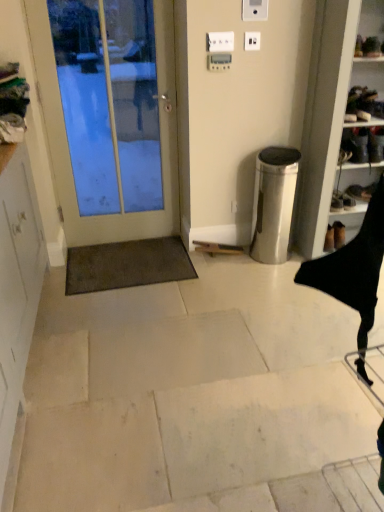
What do you see at coordinates (219, 42) in the screenshot? Image resolution: width=384 pixels, height=512 pixels. I see `white plastic electric outlet at upper center, which appears as the 2th electric outlet when viewed from the right` at bounding box center [219, 42].

The image size is (384, 512). Describe the element at coordinates (362, 145) in the screenshot. I see `black leather shoes at right` at that location.

Where is `brown shaggy mat at lower left`? Image resolution: width=384 pixels, height=512 pixels. brown shaggy mat at lower left is located at coordinates (127, 265).

Where is `white matte cabinet at left`? This screenshot has height=512, width=384. white matte cabinet at left is located at coordinates (17, 287).

Where is `white plastic electric outlet at upper center, arranged as the first electric outlet when viewed from the left`? white plastic electric outlet at upper center, arranged as the first electric outlet when viewed from the left is located at coordinates (219, 42).

Is black leather shoes at right completely or partially outside of white matte cabinet at left?

black leather shoes at right is positioned outside white matte cabinet at left.

Is black leather shoes at right in front of or behind white matte cabinet at left in the image?

black leather shoes at right is positioned farther from the viewer than white matte cabinet at left.

From a real-world perspective, is black leather shoes at right positioned over white matte cabinet at left based on gravity?

Yes.

Considering the relative sizes of black leather shoes at right and white matte cabinet at left in the image provided, is black leather shoes at right shorter than white matte cabinet at left?

Indeed, black leather shoes at right has a lesser height compared to white matte cabinet at left.

Is point (212, 42) less distant than point (172, 67)?

Yes.

Identify the location of the 1st electric outlet behind the white glossy door at left. This screenshot has height=512, width=384. (219, 42).

Is white plastic electric outlet at upper center, which appears as the 2th electric outlet when viewed from the right, looking in the opposite direction of white glossy door at left?

No, white plastic electric outlet at upper center, which appears as the 2th electric outlet when viewed from the right, is not facing away from white glossy door at left.

Measure the distance from white plastic electric outlet at upper center, arranged as the first electric outlet when viewed from the left, to white glossy door at left.

They are 31.67 inches apart.

From a real-world perspective, is white glossy door at left positioned above or below brown shaggy mat at lower left?

Clearly, from a real-world perspective, white glossy door at left is above brown shaggy mat at lower left.

Could you tell me if white glossy door at left is turned towards brown shaggy mat at lower left?

Yes, white glossy door at left faces towards brown shaggy mat at lower left.

Which point is more forward, (178, 190) or (123, 284)?

The point (123, 284) is in front.

Considering the relative positions of white glossy door at left and brown shaggy mat at lower left in the image provided, is white glossy door at left to the left of brown shaggy mat at lower left from the viewer's perspective?

Correct, you'll find white glossy door at left to the left of brown shaggy mat at lower left.

Is white matte cabinet at left facing away from white plastic electric outlet at upper center, which appears as the 2th electric outlet when viewed from the right?

That's not correct — white matte cabinet at left is not looking away from white plastic electric outlet at upper center, which appears as the 2th electric outlet when viewed from the right.

There is a white matte cabinet at left. Where is `the 2nd electric outlet above it (from a real-world perspective)`? The image size is (384, 512). the 2nd electric outlet above it (from a real-world perspective) is located at coordinates (219, 42).

From the picture: From a real-world perspective, is white matte cabinet at left located beneath white plastic electric outlet at upper center, arranged as the first electric outlet when viewed from the left?

Yes, from a real-world perspective, white matte cabinet at left is below white plastic electric outlet at upper center, arranged as the first electric outlet when viewed from the left.

From the image's perspective, is white plastic electric outlet at upper center, arranged as the first electric outlet when viewed from the left, located above or below white plastic electric outlet at upper center, which is the second electric outlet in left-to-right order?

Clearly, from the image's perspective, white plastic electric outlet at upper center, arranged as the first electric outlet when viewed from the left, is below white plastic electric outlet at upper center, which is the second electric outlet in left-to-right order.

Does white plastic electric outlet at upper center, arranged as the first electric outlet when viewed from the left, have a greater width compared to white plastic electric outlet at upper center, which appears as the 1th electric outlet when viewed from the right?

Indeed, white plastic electric outlet at upper center, arranged as the first electric outlet when viewed from the left, has a greater width compared to white plastic electric outlet at upper center, which appears as the 1th electric outlet when viewed from the right.

Based on the photo, from a real-world perspective, is white plastic electric outlet at upper center, which appears as the 2th electric outlet when viewed from the right, physically above white plastic electric outlet at upper center, which appears as the 1th electric outlet when viewed from the right?

Yes, from a real-world perspective, white plastic electric outlet at upper center, which appears as the 2th electric outlet when viewed from the right, is on top of white plastic electric outlet at upper center, which appears as the 1th electric outlet when viewed from the right.

Is white plastic electric outlet at upper center, which appears as the 2th electric outlet when viewed from the right, facing away from white plastic electric outlet at upper center, which is the second electric outlet in left-to-right order?

white plastic electric outlet at upper center, which appears as the 2th electric outlet when viewed from the right, does not have its back to white plastic electric outlet at upper center, which is the second electric outlet in left-to-right order.

Does white glossy door at left have a smaller size compared to white plastic electric outlet at upper center, which is the second electric outlet in left-to-right order?

No, white glossy door at left is not smaller than white plastic electric outlet at upper center, which is the second electric outlet in left-to-right order.

Does white glossy door at left appear on the right side of white plastic electric outlet at upper center, which appears as the 1th electric outlet when viewed from the right?

No.

In the scene shown: From the image's perspective, is white glossy door at left positioned above or below white plastic electric outlet at upper center, which appears as the 1th electric outlet when viewed from the right?

white glossy door at left is below white plastic electric outlet at upper center, which appears as the 1th electric outlet when viewed from the right.

Can we say white glossy door at left lies outside black leather shoes at right?

white glossy door at left lies outside black leather shoes at right's area.

From the image's perspective, is white glossy door at left positioned above or below black leather shoes at right?

white glossy door at left is above black leather shoes at right.

Who is more distant, white glossy door at left or black leather shoes at right?

black leather shoes at right.

Considering the sizes of objects white glossy door at left and black leather shoes at right in the image provided, who is wider, white glossy door at left or black leather shoes at right?

black leather shoes at right is wider.

The height and width of the screenshot is (512, 384). I want to click on cabinetry on the left of the black leather shoes at right, so click(17, 287).

The image size is (384, 512). In the image, there is a white plastic electric outlet at upper center, arranged as the first electric outlet when viewed from the left. Identify the location of door below it (from the image's perspective). (68, 147).

Estimate the real-world distances between objects in this image. Which object is closer to white plastic electric outlet at upper center, which appears as the 1th electric outlet when viewed from the right, white plastic electric outlet at upper center, arranged as the first electric outlet when viewed from the left, or white glossy door at left?

white plastic electric outlet at upper center, arranged as the first electric outlet when viewed from the left, lies closer to white plastic electric outlet at upper center, which appears as the 1th electric outlet when viewed from the right, than the other object.

Based on their spatial positions, is brown shaggy mat at lower left or white glossy door at left closer to white matte cabinet at left?

The object closer to white matte cabinet at left is brown shaggy mat at lower left.

Looking at the image, which one is located closer to white plastic electric outlet at upper center, which is the second electric outlet in left-to-right order, white matte cabinet at left or white glossy door at left?

white glossy door at left is positioned closer to the anchor white plastic electric outlet at upper center, which is the second electric outlet in left-to-right order.

Estimate the real-world distances between objects in this image. Which object is further from white glossy door at left, white plastic electric outlet at upper center, which appears as the 2th electric outlet when viewed from the right, or white matte cabinet at left?

Among the two, white matte cabinet at left is located further to white glossy door at left.

Considering their positions, is black leather shoes at right positioned closer to brown shaggy mat at lower left than white plastic electric outlet at upper center, which appears as the 2th electric outlet when viewed from the right?

white plastic electric outlet at upper center, which appears as the 2th electric outlet when viewed from the right, is positioned closer to the anchor brown shaggy mat at lower left.

Estimate the real-world distances between objects in this image. Which object is further from white plastic electric outlet at upper center, which appears as the 2th electric outlet when viewed from the right, white plastic electric outlet at upper center, which is the second electric outlet in left-to-right order, or white glossy door at left?

Based on the image, white glossy door at left appears to be further to white plastic electric outlet at upper center, which appears as the 2th electric outlet when viewed from the right.

From the image, which object appears to be nearer to white glossy door at left, white matte cabinet at left or white plastic electric outlet at upper center, which is the second electric outlet in left-to-right order?

white matte cabinet at left is positioned closer to the anchor white glossy door at left.

Based on their spatial positions, is brown shaggy mat at lower left or black leather shoes at right closer to white plastic electric outlet at upper center, which is the second electric outlet in left-to-right order?

black leather shoes at right is closer to white plastic electric outlet at upper center, which is the second electric outlet in left-to-right order.

Image resolution: width=384 pixels, height=512 pixels. I want to click on door positioned between white matte cabinet at left and white plastic electric outlet at upper center, which is the second electric outlet in left-to-right order, from near to far, so click(68, 147).

I want to click on door between white plastic electric outlet at upper center, arranged as the first electric outlet when viewed from the left, and brown shaggy mat at lower left from top to bottom, so click(x=68, y=147).

Locate an element on the screen. door situated between white matte cabinet at left and black leather shoes at right from left to right is located at coordinates (68, 147).

This screenshot has width=384, height=512. I want to click on electric outlet between white plastic electric outlet at upper center, which appears as the 1th electric outlet when viewed from the right, and brown shaggy mat at lower left vertically, so click(x=219, y=42).